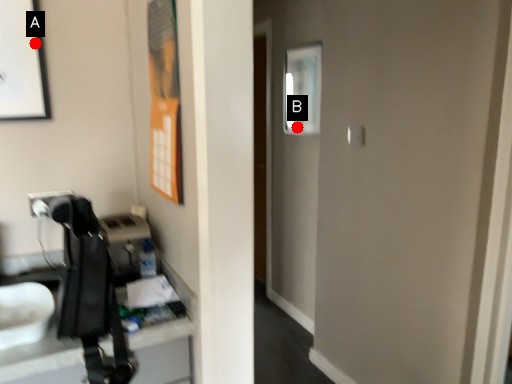
Question: Two points are circled on the image, labeled by A and B beside each circle. Which point is farther to the camera?

Choices:
 (A) A is further
 (B) B is further

Answer: (B)